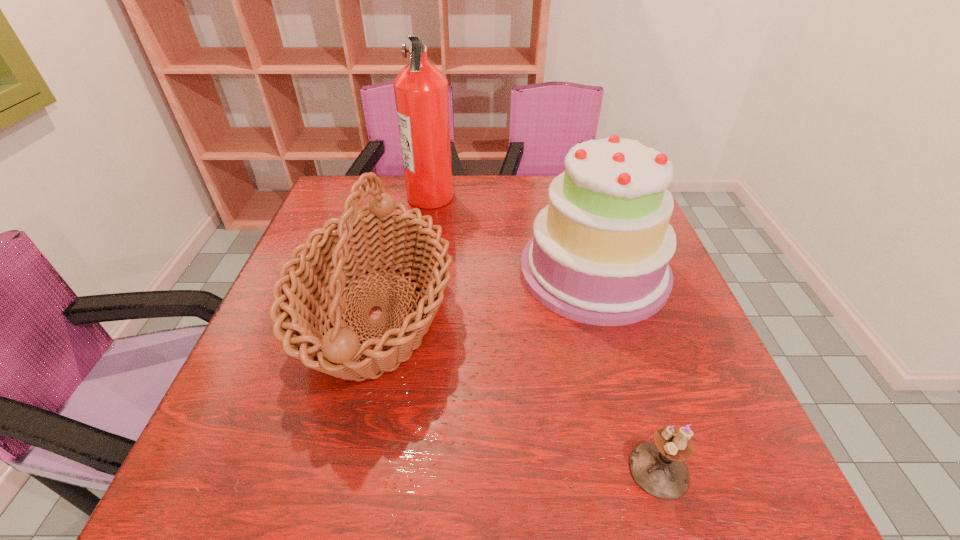
Locate which object ranks in proximity to the basket. Please provide its 2D coordinates. Your answer should be formatted as a tuple, i.e. [(x, y)], where the tuple contains the x and y coordinates of a point satisfying the conditions above.

[(421, 93)]

Find the location of a particular element. free space that satisfies the following two spatial constraints: 1. at the nozzle of the farthest object; 2. on the back side of the shortest object is located at coordinates pyautogui.click(x=388, y=469).

Locate an element on the screen. blank space that satisfies the following two spatial constraints: 1. at the nozzle of the farthest object; 2. on the right side of the shortest object is located at coordinates (388, 469).

Find the location of a particular element. The image size is (960, 540). free space that satisfies the following two spatial constraints: 1. at the nozzle of the cake; 2. on the right side of the tallest object is located at coordinates (419, 271).

At what (x,y) coordinates should I click in order to perform the action: click on vacant space that satisfies the following two spatial constraints: 1. at the nozzle of the farthest object; 2. on the left side of the cake. Please return your answer as a coordinate pair (x, y). Image resolution: width=960 pixels, height=540 pixels. Looking at the image, I should click on (419, 271).

Find the location of a particular element. This screenshot has width=960, height=540. free point that satisfies the following two spatial constraints: 1. on the back side of the cake; 2. at the nozzle of the tallest object is located at coordinates (572, 196).

I want to click on vacant space that satisfies the following two spatial constraints: 1. at the nozzle of the fire extinguisher; 2. on the back side of the cake, so click(419, 271).

Image resolution: width=960 pixels, height=540 pixels. In order to click on free region that satisfies the following two spatial constraints: 1. at the nozzle of the tallest object; 2. on the left side of the nearest object in this screenshot , I will do `click(388, 469)`.

What are the coordinates of `free space that satisfies the following two spatial constraints: 1. on the back side of the cake; 2. on the right side of the basket` in the screenshot? It's located at (387, 271).

Identify the location of vacant space that satisfies the following two spatial constraints: 1. on the back side of the shortest object; 2. at the nozzle of the tallest object. This screenshot has height=540, width=960. (576, 196).